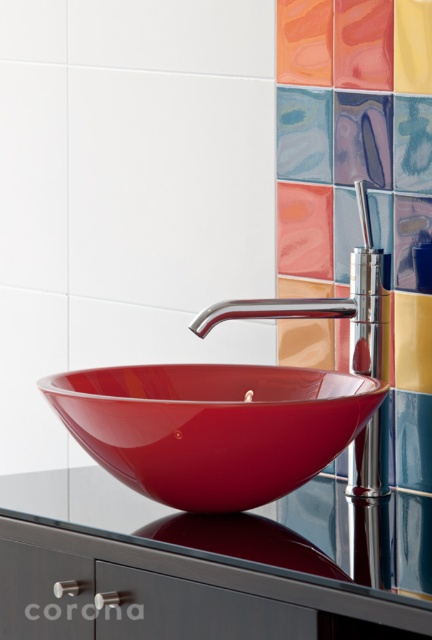
Question: Which object is positioned farthest from the chrome metallic faucet at center?

Choices:
 (A) glossy glass counter at center
 (B) matte pink tile at center
 (C) orange glossy tile at upper center

Answer: (C)

Question: Which of the following is the farthest from the observer?

Choices:
 (A) 289,148
 (B) 329,312

Answer: (A)

Question: Which of the following is the farthest from the observer?

Choices:
 (A) (259, 449)
 (B) (286, 150)

Answer: (B)

Question: Does glossy glass counter at center appear over matte pink tile at center?

Choices:
 (A) yes
 (B) no

Answer: (B)

Question: Can you confirm if glossy glass bowl at center is positioned below chrome metallic faucet at center?

Choices:
 (A) no
 (B) yes

Answer: (B)

Question: Is glossy glass counter at center closer to the viewer compared to glossy glass bowl at center?

Choices:
 (A) no
 (B) yes

Answer: (B)